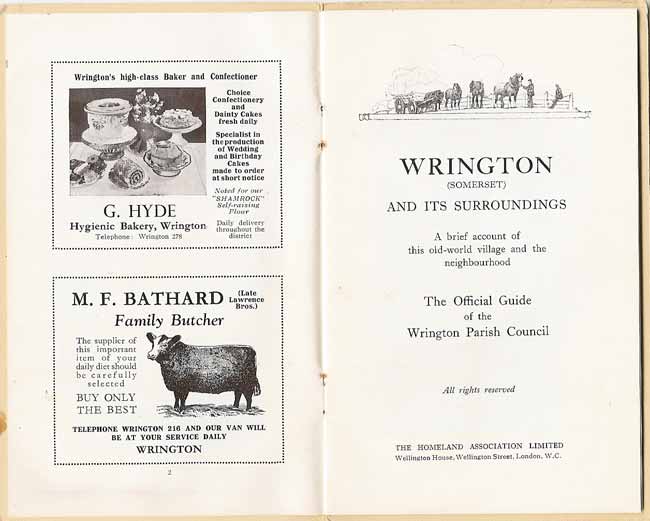
Find the location of a particular element. This screenshot has width=650, height=521. book is located at coordinates (537, 412).